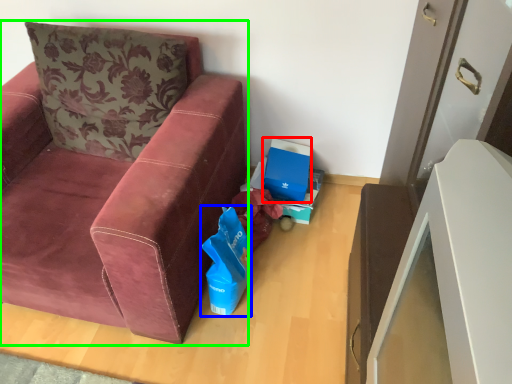
Question: Considering the real-world distances, which object is farthest from cardboard box (highlighted by a red box)? gift bag (highlighted by a blue box) or studio couch (highlighted by a green box)?

Choices:
 (A) gift bag
 (B) studio couch

Answer: (B)